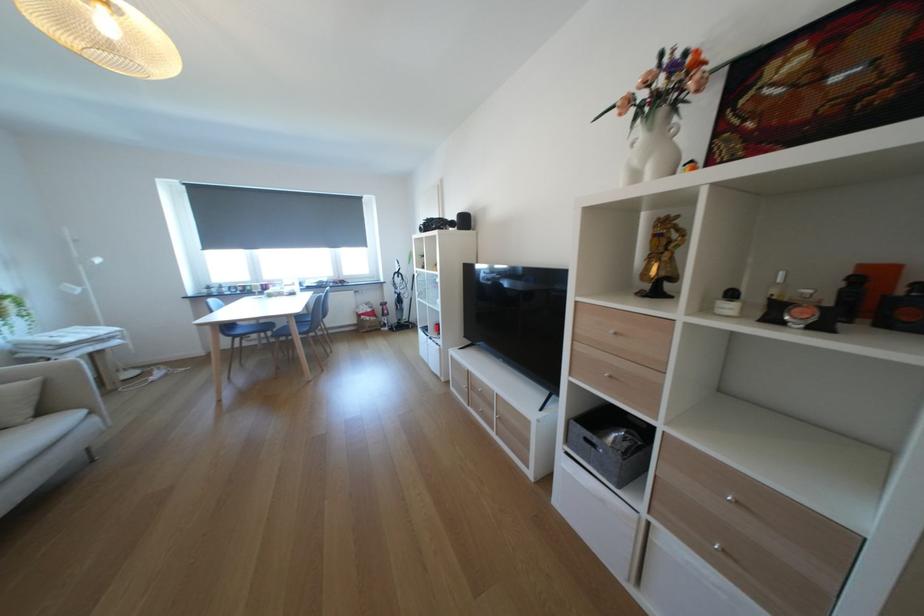
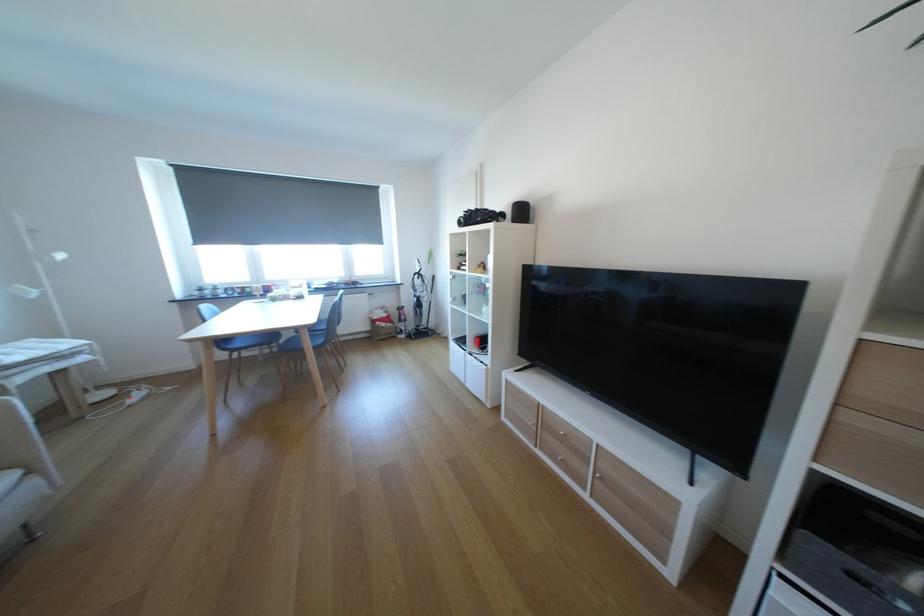
Question: The first image is from the beginning of the video and the second image is from the end. How did the camera likely rotate when shooting the video?

Choices:
 (A) Left
 (B) Right
 (C) Up
 (D) Down

Answer: (B)